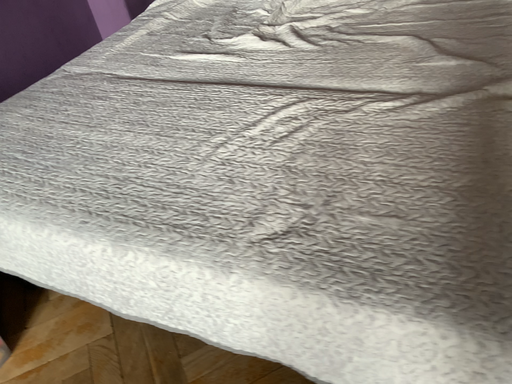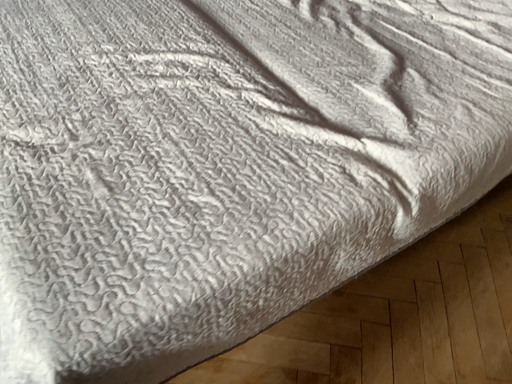
Question: How did the camera likely rotate when shooting the video?

Choices:
 (A) rotated left
 (B) rotated right

Answer: (A)